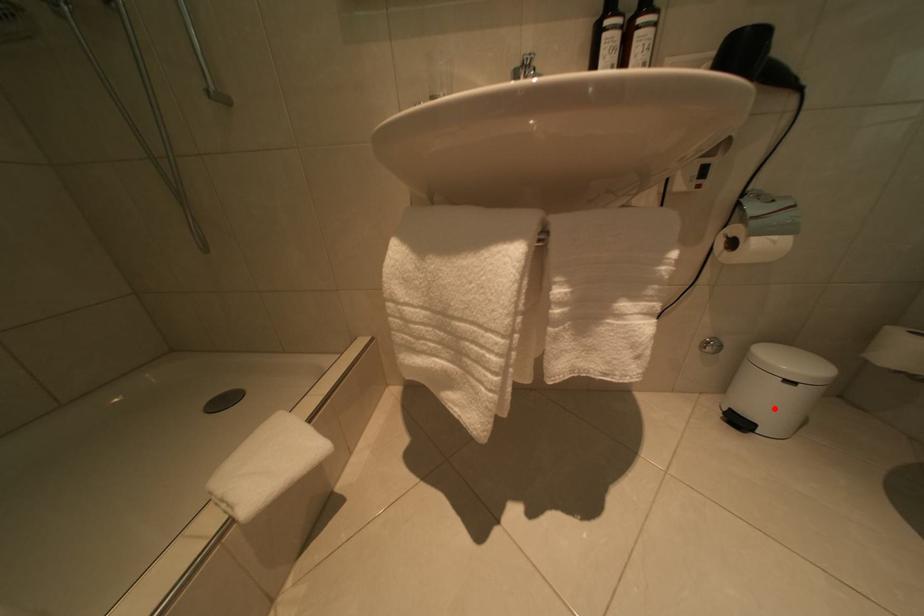
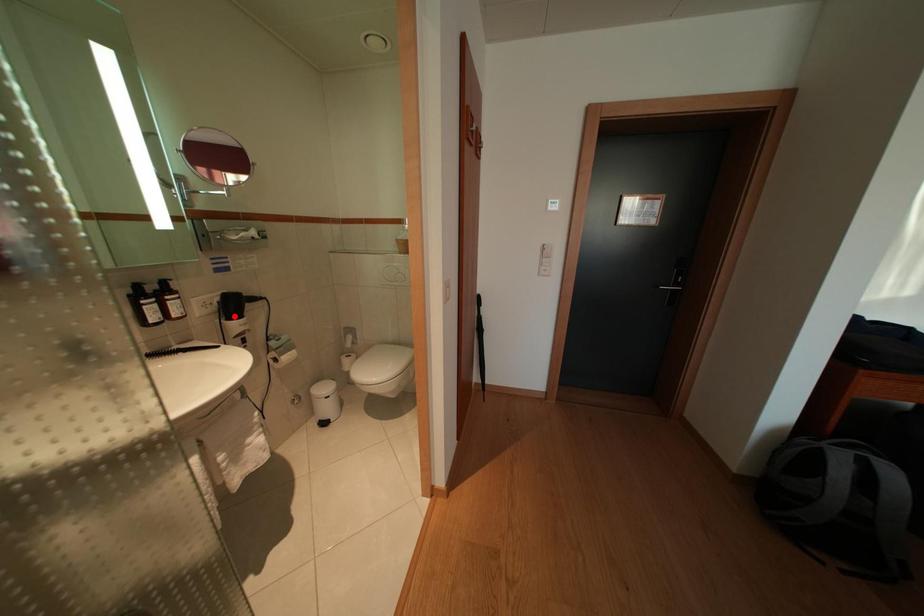
I am providing you with two images of the same scene from different viewpoints. A red point is marked on the first image and another point is marked on the second image. Do the highlighted points in image1 and image2 indicate the same real-world spot?

No